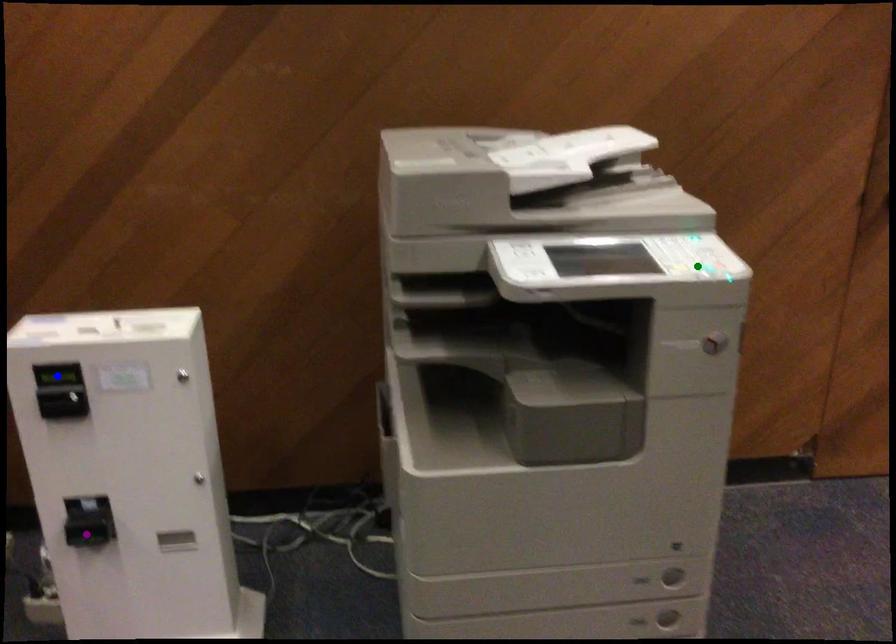
Order these from farthest to nearest:
1. blue point
2. purple point
3. green point

purple point, blue point, green point